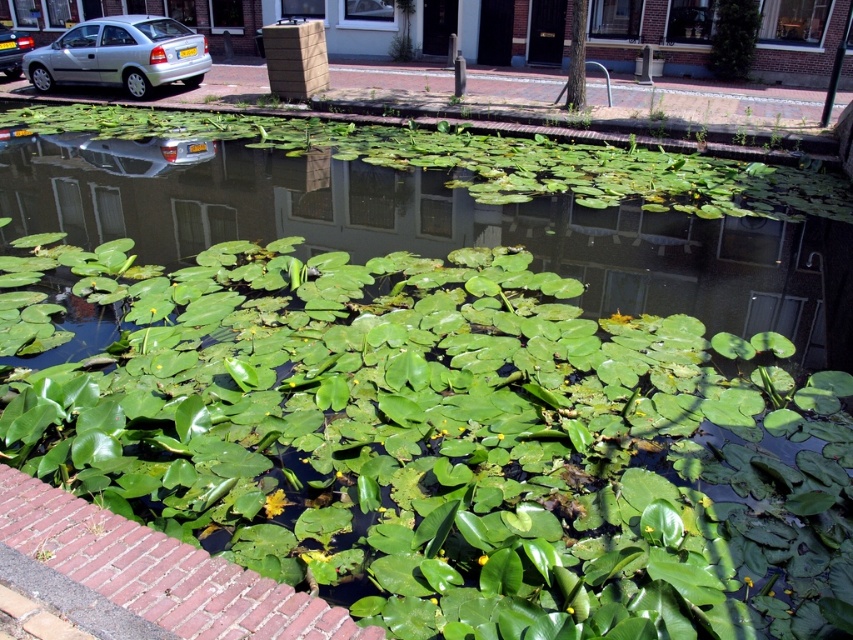
Question: Among these objects, which one is farthest from the camera?

Choices:
 (A) green leafy plant at center
 (B) matte silver car at left
 (C) silver metallic car at upper left

Answer: (B)

Question: Which point is farther to the camera?

Choices:
 (A) coord(16,45)
 (B) coord(51,54)
 (C) coord(341,464)

Answer: (A)

Question: Is silver metallic car at upper left to the left of matte silver car at left from the viewer's perspective?

Choices:
 (A) yes
 (B) no

Answer: (B)

Question: Does green leafy plant at center appear on the right side of matte silver car at left?

Choices:
 (A) yes
 (B) no

Answer: (A)

Question: Which point is closer to the camera?

Choices:
 (A) (775, 397)
 (B) (3, 33)
 (C) (122, 48)

Answer: (A)

Question: Is green leafy plant at center to the right of matte silver car at left from the viewer's perspective?

Choices:
 (A) yes
 (B) no

Answer: (A)